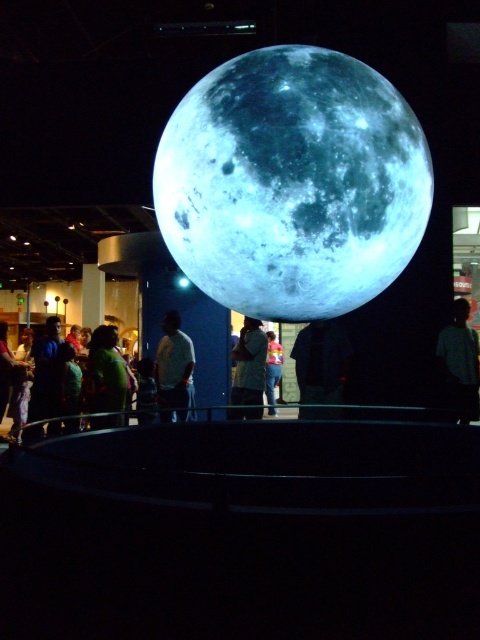
Looking at this image, you are a visitor at a museum exhibit featuring the moon model. You notice the shiny metallic moon at center and the blue fabric shirt at center. Which object is closer to you?

The shiny metallic moon at center is closer to you than the blue fabric shirt at center.

You are standing in front of the moon exhibit and want to take a photo. There are two points marked on the platform where you can stand. One is at point (x=304, y=385) and the other at point (x=106, y=364). Which point is closer to the moon display?

Point (x=304, y=385) is further to the camera than point (x=106, y=364), so the point closer to the moon display would be point (x=106, y=364).

You are standing in front of the moon exhibit. There is a point at coordinates (321,362). What is this point located on?

The point at coordinates (321,362) is located on the black fabric at center.